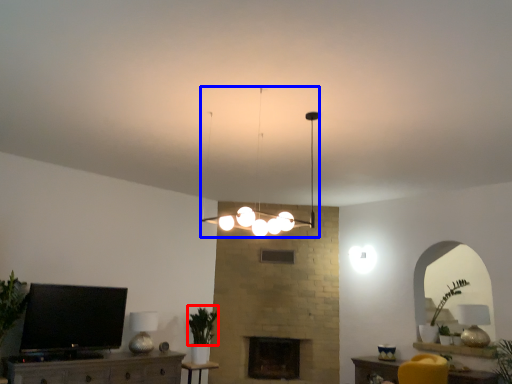
Question: Among these objects, which one is nearest to the camera, plant (highlighted by a red box) or lamp (highlighted by a blue box)?

Choices:
 (A) plant
 (B) lamp

Answer: (B)